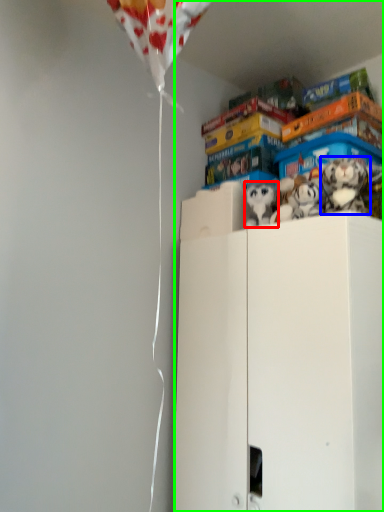
Question: Which object is positioned farthest from toy (highlighted by a red box)? Select from toy (highlighted by a blue box) and cabinetry (highlighted by a green box).

Choices:
 (A) toy
 (B) cabinetry

Answer: (B)